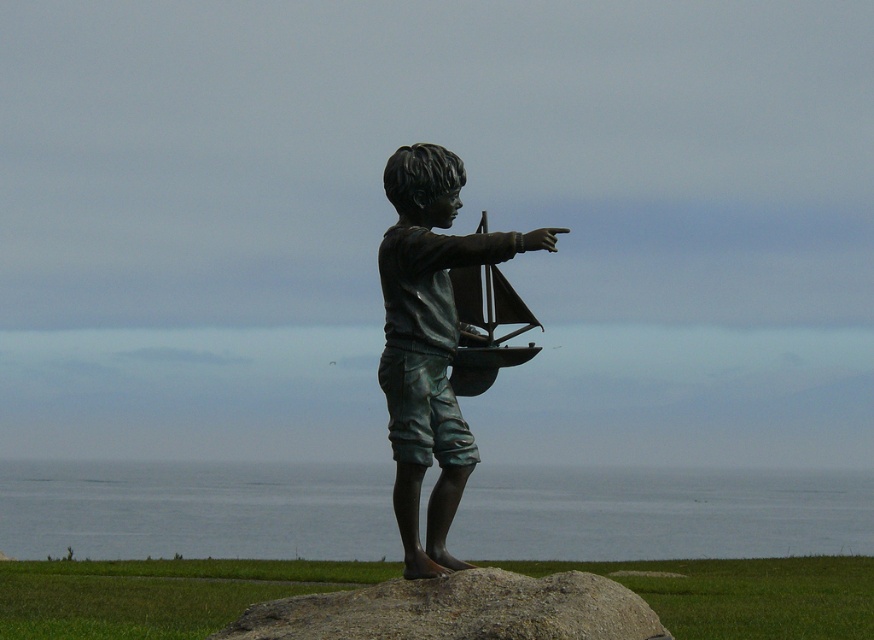
Question: Is gray water at lower center positioned at the back of gray granite rock at center?

Choices:
 (A) no
 (B) yes

Answer: (B)

Question: Where is gray water at lower center located in relation to bronze statue of boy pointing at center in the image?

Choices:
 (A) below
 (B) above

Answer: (A)

Question: Does gray water at lower center have a lesser width compared to bronze statue of boy pointing at center?

Choices:
 (A) no
 (B) yes

Answer: (A)

Question: Estimate the real-world distances between objects in this image. Which object is farther from the gray granite rock at center?

Choices:
 (A) bronze statue of boy pointing at center
 (B) gray water at lower center

Answer: (B)

Question: Which object is the closest to the bronze statue of boy pointing at center?

Choices:
 (A) gray granite rock at center
 (B) gray water at lower center

Answer: (A)

Question: Which object is closer to the camera taking this photo?

Choices:
 (A) gray granite rock at center
 (B) gray water at lower center

Answer: (A)